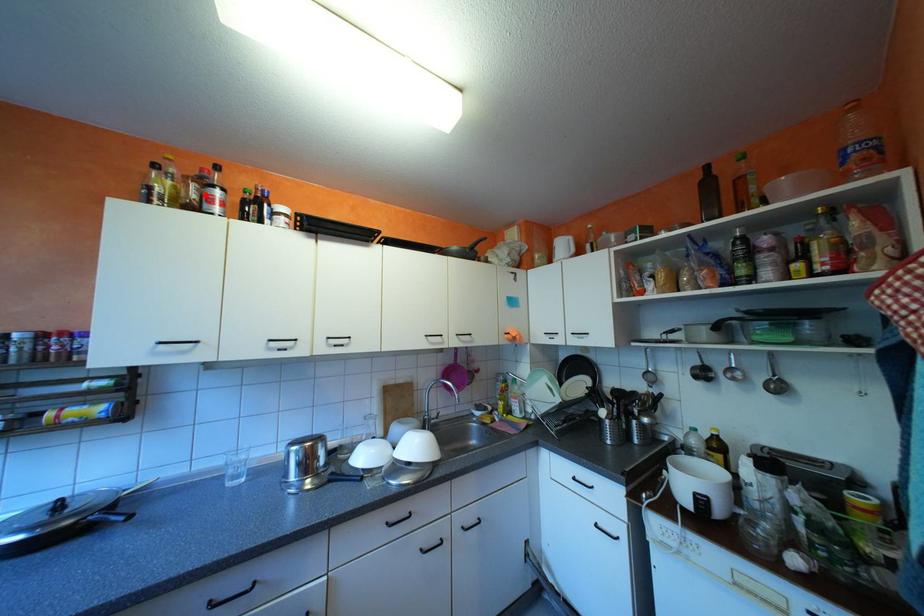
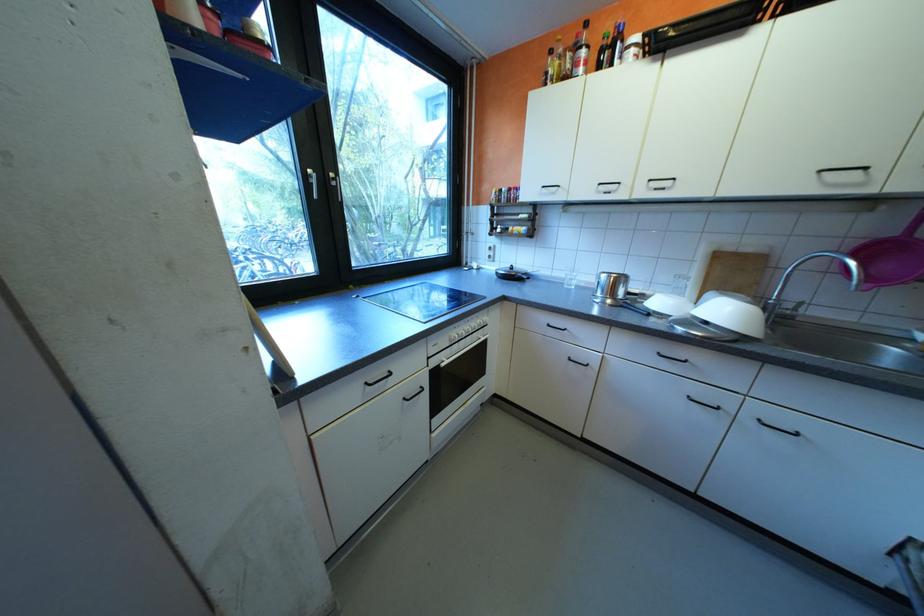
Find the pixel in the second image that matches the highlighted location in the first image.

(580, 65)